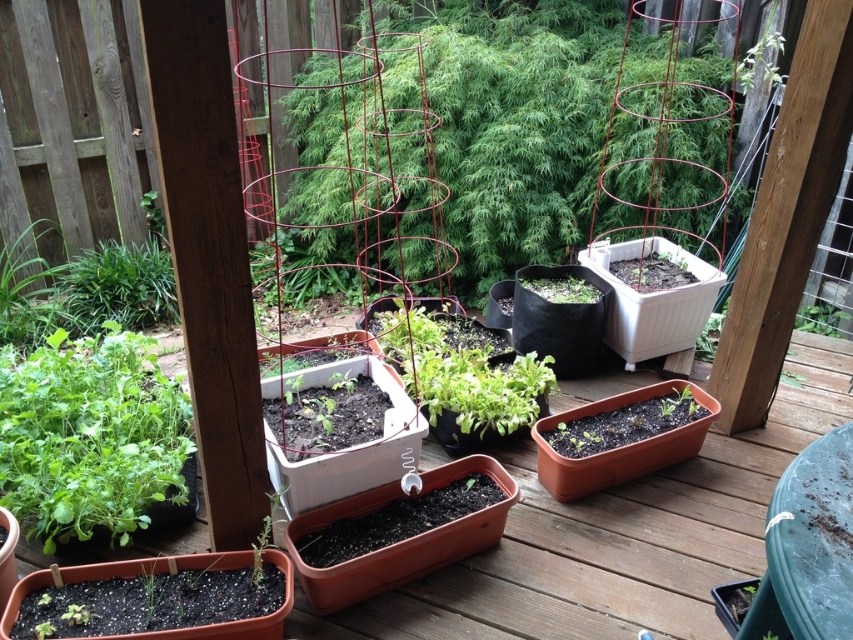
You are standing on the wooden deck and want to place a new potted plant at the point marked as point [74,368]. Considering the deck is 8 feet wide, will the new plant be within the deck boundaries?

The distance of point [74,368] from camera is 6.57 feet, so placing the new plant at that point would be within the deck boundaries since it is closer than the deck width of 8 feet.

You are standing on the wooden deck and see the green leafy plant at lower right and the green matte plant at lower left. Which one is located to the right of the other?

The green leafy plant at lower right is positioned on the right side of the green matte plant at lower left.

You are a gardener who wants to place a new statue that is 1 meter tall between the green leafy plant at lower right and the green matte plant at lower left. Based on their heights, will the statue be taller than both plants?

The green leafy plant at lower right is shorter than the green matte plant at lower left. Since the statue is 1 meter tall, we need to compare it with the taller plant. However, the height of the green matte plant at lower left is not provided. Therefore, it is impossible to determine if the statue will be taller than both plants without additional information.